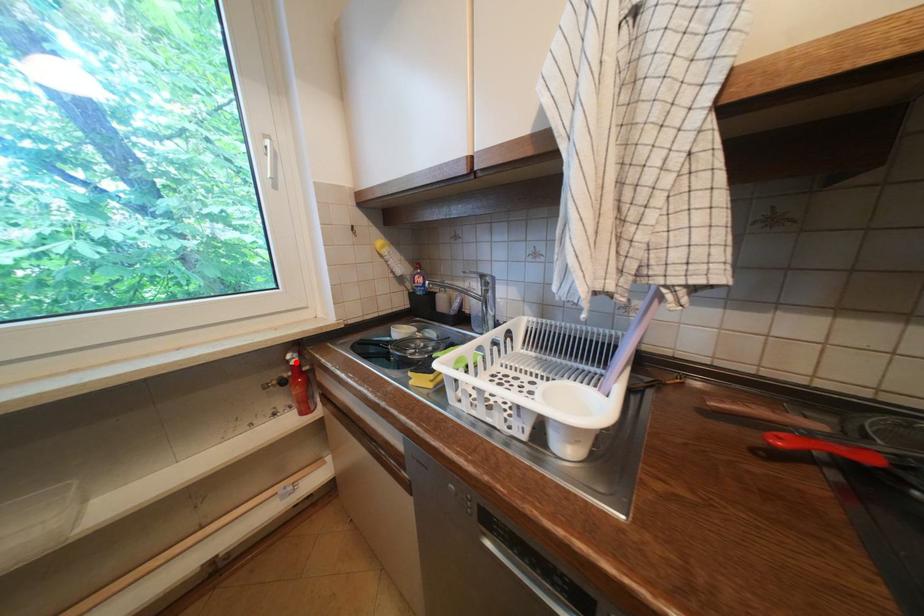
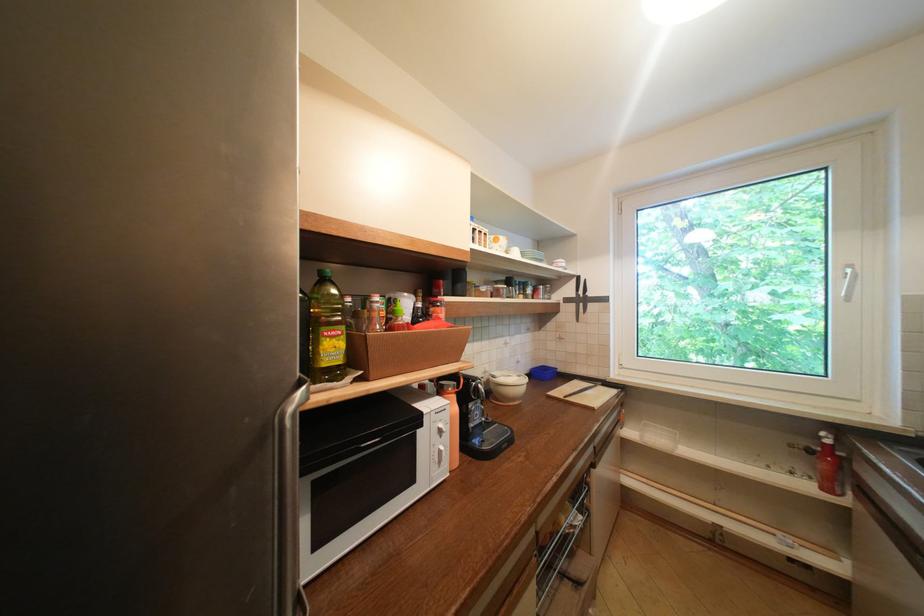
Find the pixel in the second image that matches the highlighted location in the first image.

(829, 439)